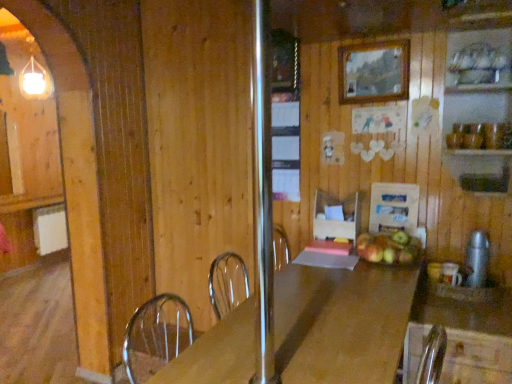
Find the location of `empty space that is ontop of wooden table at center (from a real-world perspective)`. empty space that is ontop of wooden table at center (from a real-world perspective) is located at coordinates (309, 322).